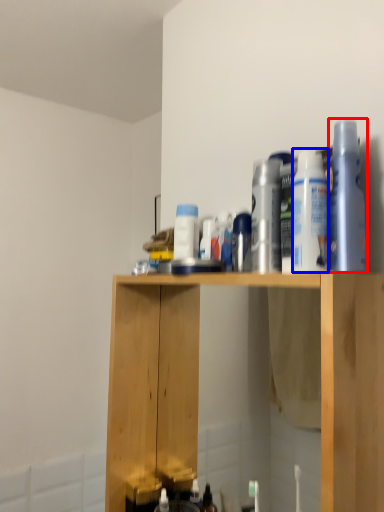
Question: Which point is closer to the camera, cleaning product (highlighted by a red box) or cleaning product (highlighted by a blue box)?

Choices:
 (A) cleaning product
 (B) cleaning product

Answer: (A)